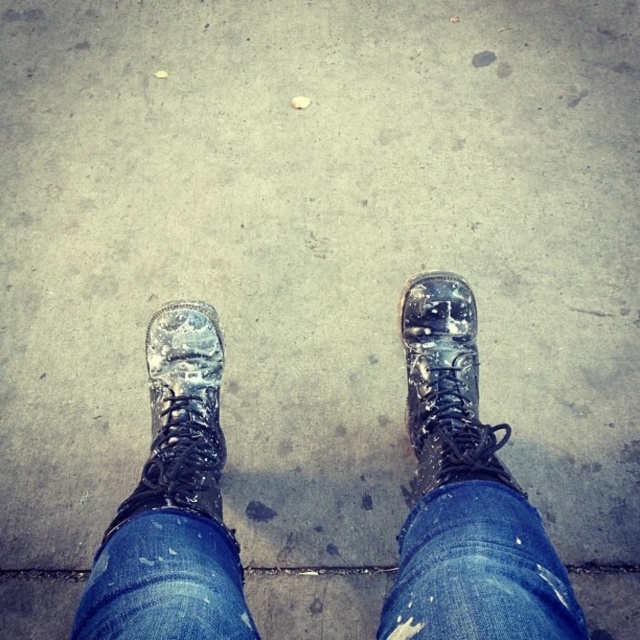
Question: Can you confirm if blue denim jeans at center is positioned below wet leather boot at lower left?

Choices:
 (A) yes
 (B) no

Answer: (A)

Question: Which object is the farthest from the glossy leather boot at center?

Choices:
 (A) blue denim jeans at center
 (B) wet leather boots at center
 (C) wet leather boot at lower left

Answer: (C)

Question: Considering the real-world distances, which object is farthest from the wet leather boot at lower left?

Choices:
 (A) blue denim jeans at center
 (B) glossy leather boot at center

Answer: (B)

Question: In this image, where is wet leather boots at center located relative to glossy leather boot at center?

Choices:
 (A) below
 (B) above

Answer: (A)

Question: Which point is closer to the camera taking this photo?

Choices:
 (A) (540, 528)
 (B) (436, 461)
 (C) (512, 516)
 (D) (166, 330)

Answer: (C)

Question: Is wet leather boots at center below glossy leather boot at center?

Choices:
 (A) no
 (B) yes

Answer: (B)